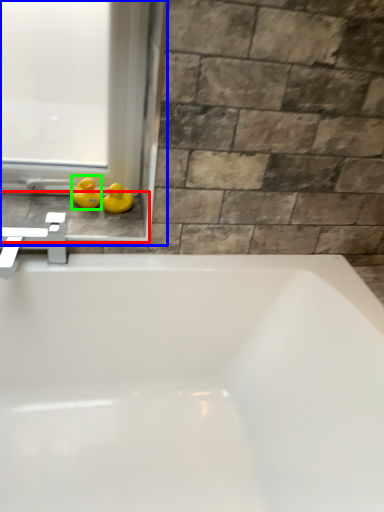
Question: Considering the real-world distances, which object is closest to window sill (highlighted by a red box)? window frame (highlighted by a blue box) or duck (highlighted by a green box).

Choices:
 (A) window frame
 (B) duck

Answer: (B)